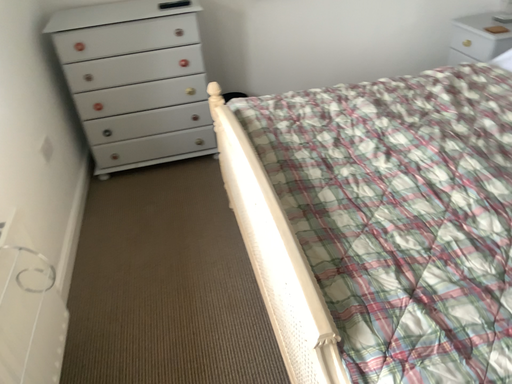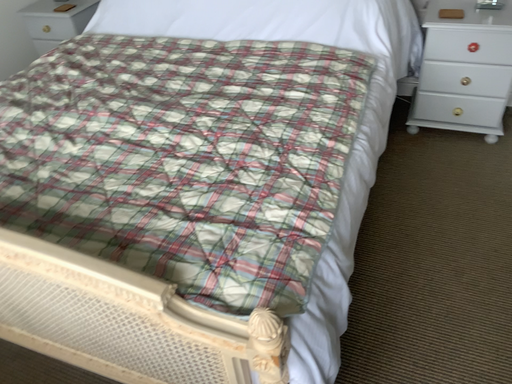
Question: Which way did the camera rotate in the video?

Choices:
 (A) rotated left
 (B) rotated right

Answer: (B)